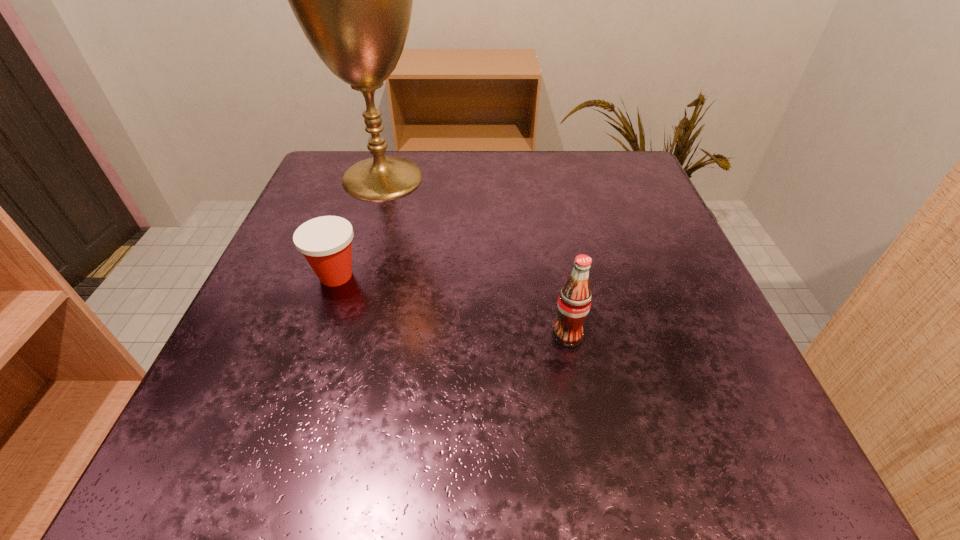
Where is `the closest object to the nearest object`? This screenshot has width=960, height=540. the closest object to the nearest object is located at coordinates (326, 242).

At what (x,y) coordinates should I click in order to perform the action: click on free spot that satisfies the following two spatial constraints: 1. on the front side of the soda; 2. on the left side of the tallest object. Please return your answer as a coordinate pair (x, y). This screenshot has width=960, height=540. Looking at the image, I should click on (336, 336).